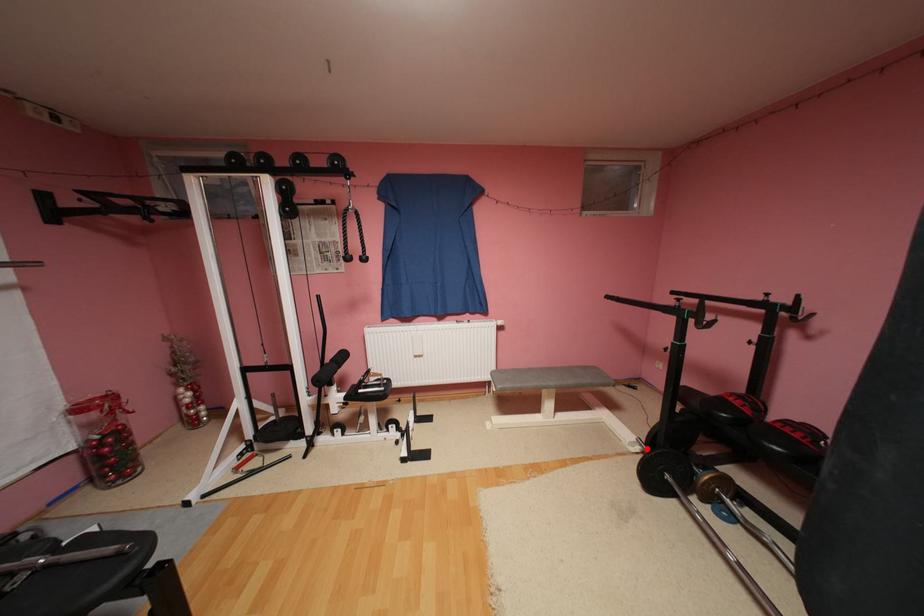
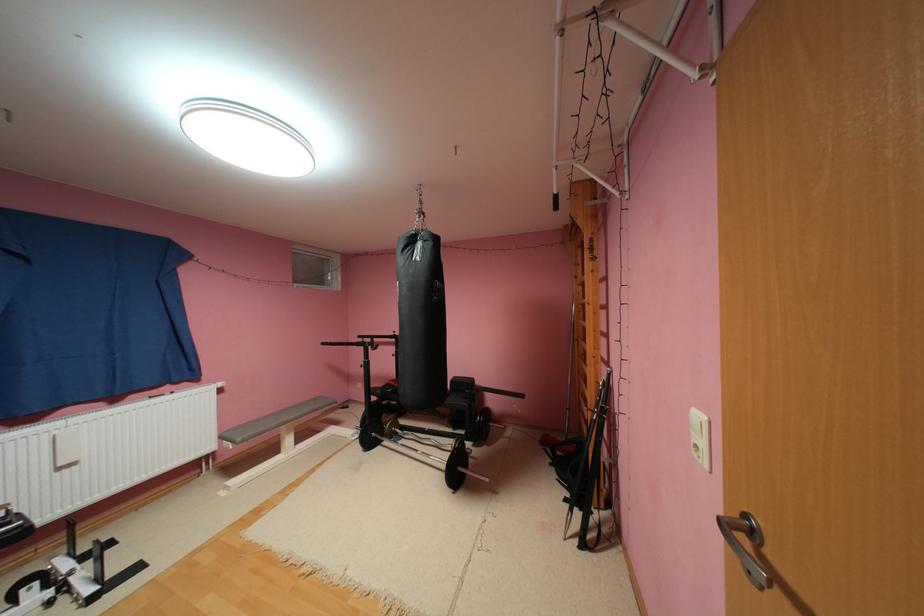
Find the pixel in the second image that matches the highlighted location in the first image.

(366, 436)